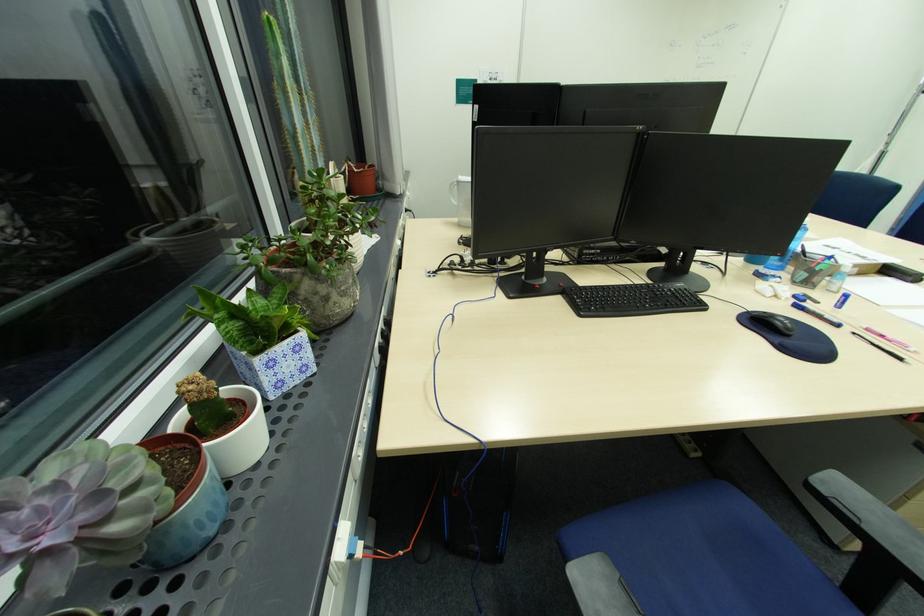
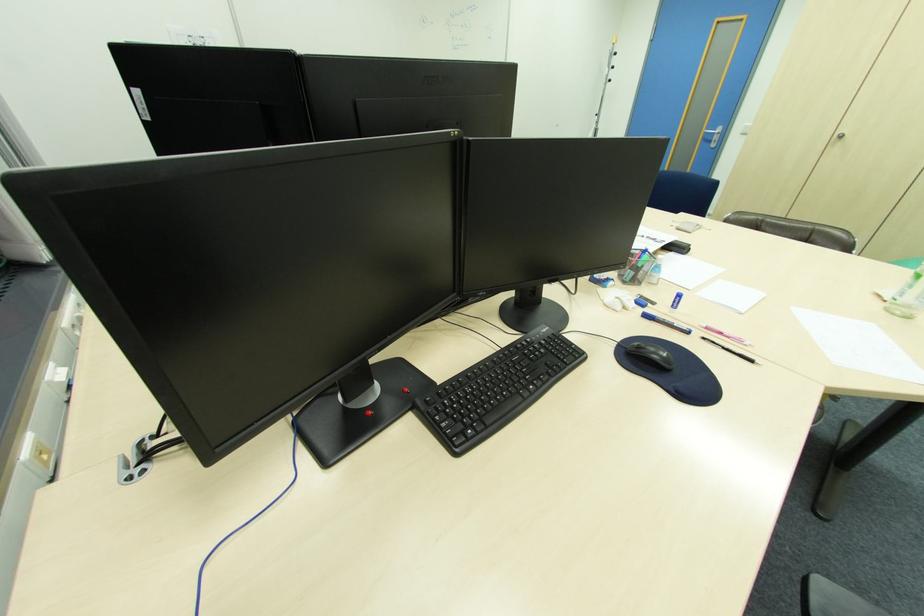
In the second image, find the point that corresponds to (803,307) in the first image.

(651, 315)